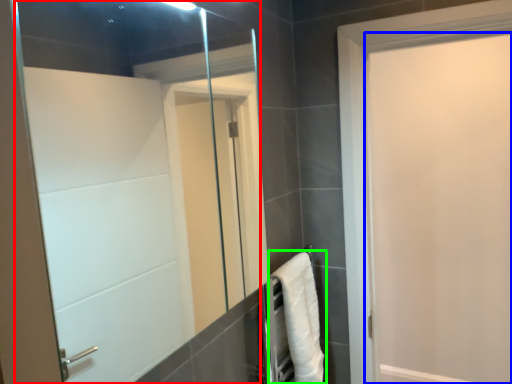
Question: Estimate the real-world distances between objects in this image. Which object is farther from mirror (highlighted by a red box), door (highlighted by a blue box) or bath towel (highlighted by a green box)?

Choices:
 (A) door
 (B) bath towel

Answer: (A)